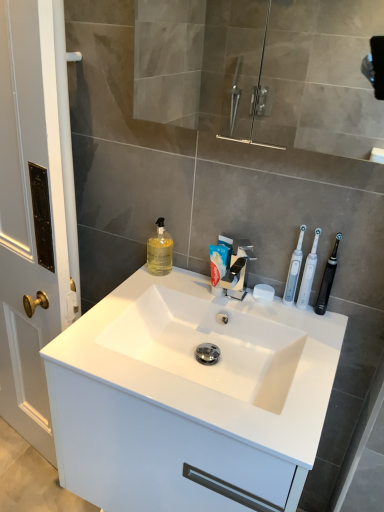
Where is `vacant area that lies between translucent yellow liquid at sink left and polished chrome faucet at center`? The height and width of the screenshot is (512, 384). vacant area that lies between translucent yellow liquid at sink left and polished chrome faucet at center is located at coordinates (189, 287).